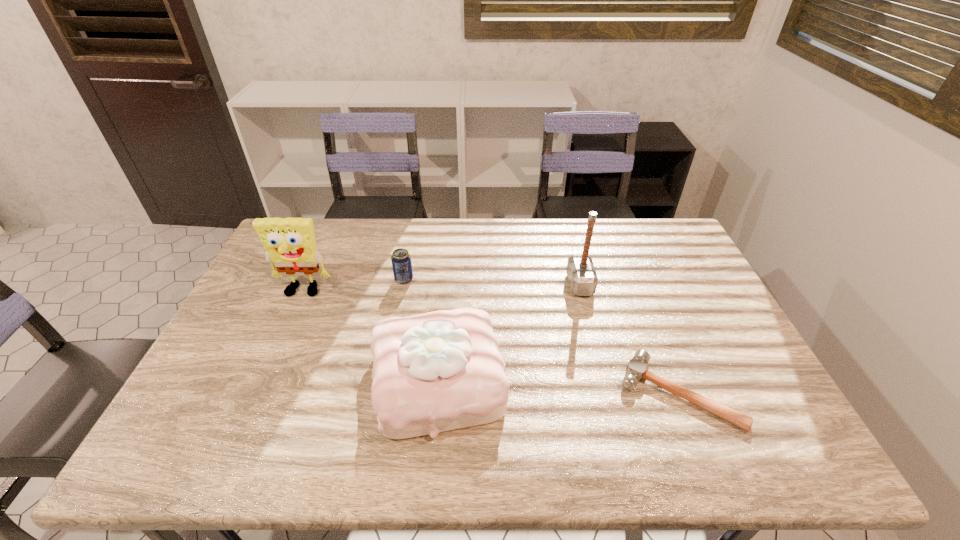
Identify the location of the second object from right to left. (581, 273).

Find the location of a particular element. The height and width of the screenshot is (540, 960). the left hammer is located at coordinates [x=581, y=273].

Where is `sponge`? The image size is (960, 540). sponge is located at coordinates (290, 243).

I want to click on cake, so click(438, 371).

Locate an element on the screen. The height and width of the screenshot is (540, 960). soda is located at coordinates (401, 260).

Locate an element on the screen. This screenshot has height=540, width=960. the nearer hammer is located at coordinates (636, 369).

Identify the location of the shorter hammer. 636,369.

At what (x,y) coordinates should I click in order to perform the action: click on vacant area located 0.190m on the striking surface of the taller hammer. Please return your answer as a coordinate pair (x, y). Image resolution: width=960 pixels, height=540 pixels. Looking at the image, I should click on (509, 285).

Image resolution: width=960 pixels, height=540 pixels. I want to click on vacant space positioned 0.280m on the striking surface of the taller hammer, so click(480, 285).

In order to click on vacant space located 0.160m on the striking surface of the taller hammer in this screenshot , I will do `click(517, 285)`.